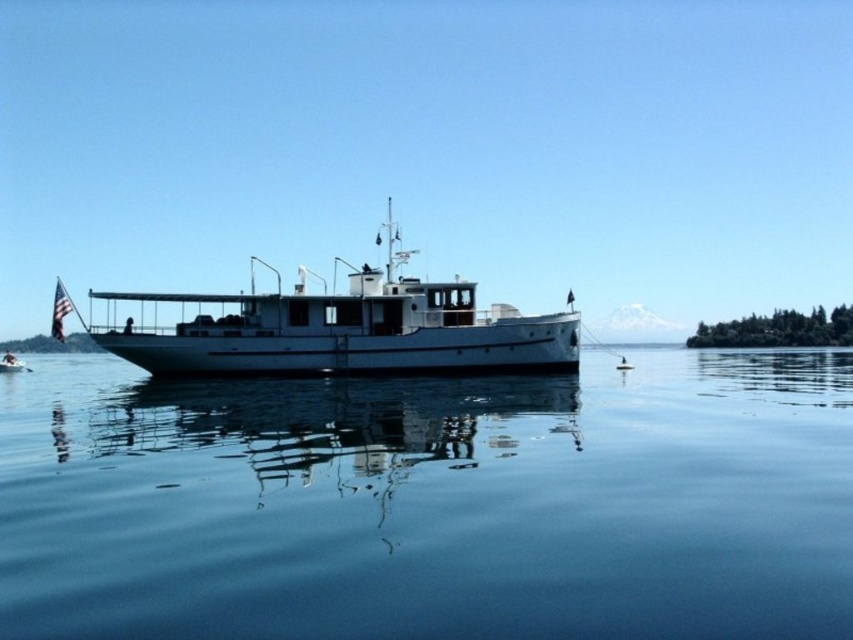
Question: Considering the real-world distances, which object is closest to the white glossy boat at left?

Choices:
 (A) transparent blue water at center
 (B) white matte boat at center

Answer: (B)

Question: Is transparent blue water at center positioned before white glossy boat at left?

Choices:
 (A) no
 (B) yes

Answer: (B)

Question: Which point is closer to the camera taking this photo?

Choices:
 (A) (16, 369)
 (B) (343, 336)
 (C) (477, 476)

Answer: (C)

Question: Is transparent blue water at center smaller than white matte boat at center?

Choices:
 (A) yes
 (B) no

Answer: (A)

Question: Can you confirm if transparent blue water at center is bigger than white matte boat at center?

Choices:
 (A) yes
 (B) no

Answer: (B)

Question: Which point appears farthest from the camera in this image?

Choices:
 (A) (558, 348)
 (B) (9, 355)
 (C) (727, 548)

Answer: (B)